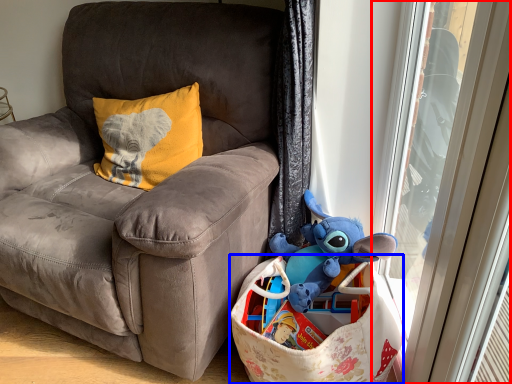
Question: Which of the following is the farthest to the observer, screen door (highlighted by a red box) or shopping bag (highlighted by a blue box)?

Choices:
 (A) screen door
 (B) shopping bag

Answer: (B)